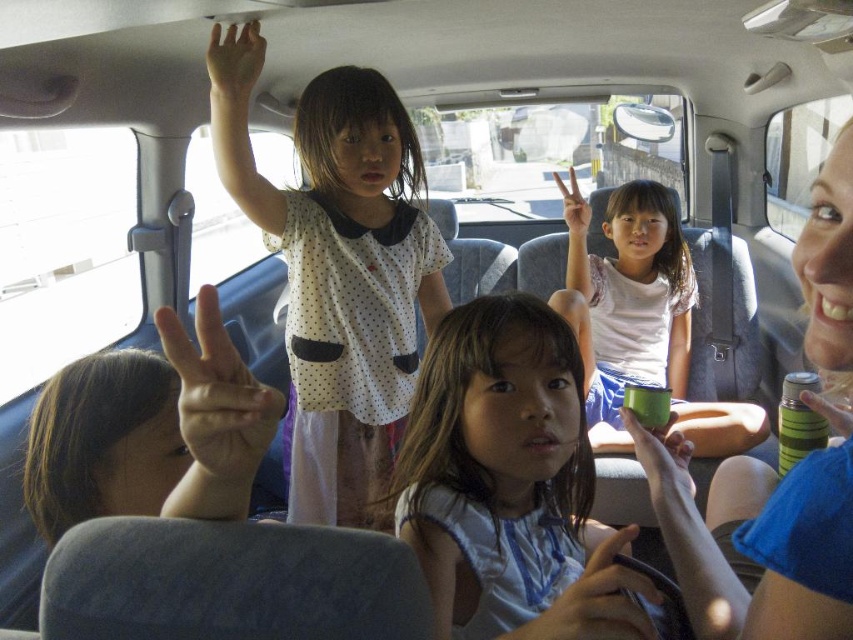
From the picture: Which of these two, light blue fabric shirt at center or matte white hand at center, stands taller?

light blue fabric shirt at center is taller.

Find the location of `light blue fabric shirt at center`. light blue fabric shirt at center is located at coordinates (508, 483).

Who is higher up, white dotted dress at center or matte green thermos at center?

white dotted dress at center

The height and width of the screenshot is (640, 853). Identify the location of white dotted dress at center. (344, 284).

Is point (297, 289) closer to viewer compared to point (846, 157)?

No, it is not.

Where is `white dotted dress at center`? This screenshot has height=640, width=853. white dotted dress at center is located at coordinates (344, 284).

Which is more to the right, white dotted dress at center or light blue fabric shirt at center?

light blue fabric shirt at center

Can you confirm if white dotted dress at center is positioned to the left of light blue fabric shirt at center?

Yes, white dotted dress at center is to the left of light blue fabric shirt at center.

Describe the element at coordinates (344, 284) in the screenshot. This screenshot has width=853, height=640. I see `white dotted dress at center` at that location.

You are a GUI agent. You are given a task and a screenshot of the screen. Output one action in this format:
    pyautogui.click(x=<x>, y=<y>)
    Task: Click on the white dotted dress at center
    The width and height of the screenshot is (853, 640).
    Given the screenshot: What is the action you would take?
    pyautogui.click(x=344, y=284)